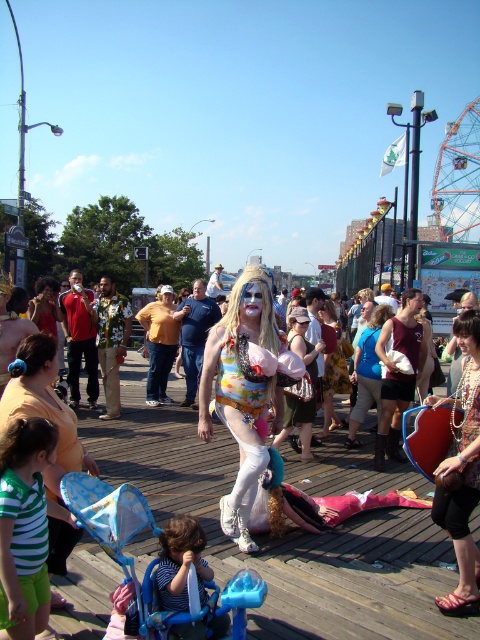
Question: Based on their relative distances, which object is farther from the colorful costume at center?

Choices:
 (A) multicolored sequined bodysuit at center
 (B) red fabric shirt at left
 (C) blue denim jeans at center

Answer: (B)

Question: Can you confirm if blue plastic baby carriage at lower left is thinner than multicolored sequined bodysuit at center?

Choices:
 (A) no
 (B) yes

Answer: (A)

Question: Can you confirm if colorful costume at center is positioned above blue plastic baby carriage at lower left?

Choices:
 (A) no
 (B) yes

Answer: (B)

Question: Which point is farther from the camera taking this photo?

Choices:
 (A) (75, 284)
 (B) (264, 593)

Answer: (A)

Question: Which of the following is the farthest from the observer?

Choices:
 (A) (227, 570)
 (B) (468, 428)
 (C) (85, 332)

Answer: (C)

Question: Can you confirm if blue plastic baby carriage at lower left is wider than multicolored sequined bodysuit at center?

Choices:
 (A) yes
 (B) no

Answer: (A)